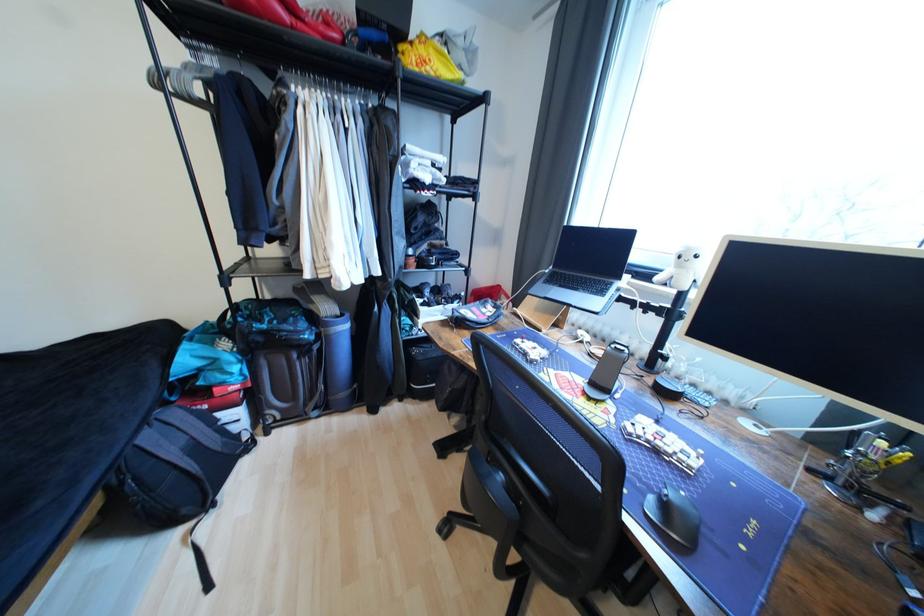
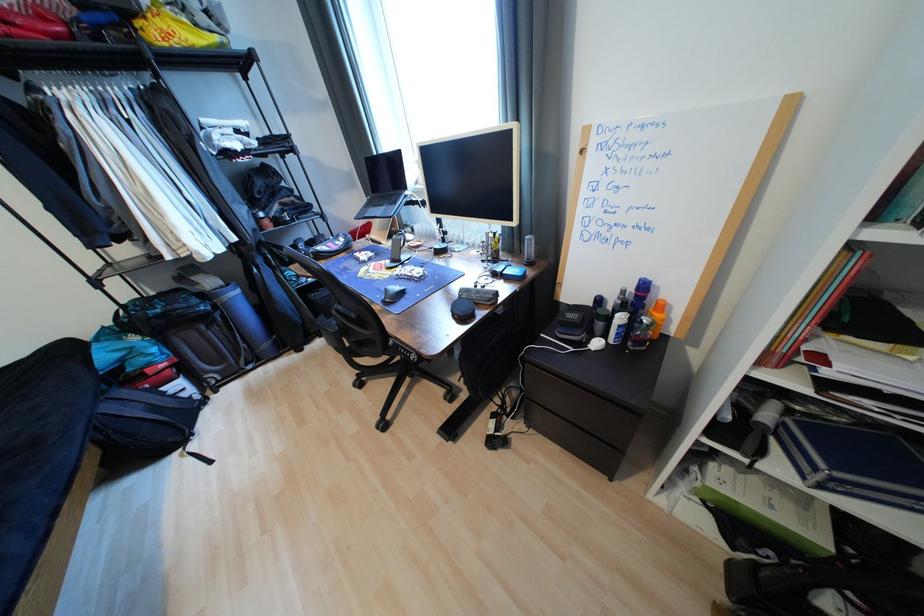
The point at (x=467, y=78) is marked in the first image. Where is the corresponding point in the second image?

(223, 39)